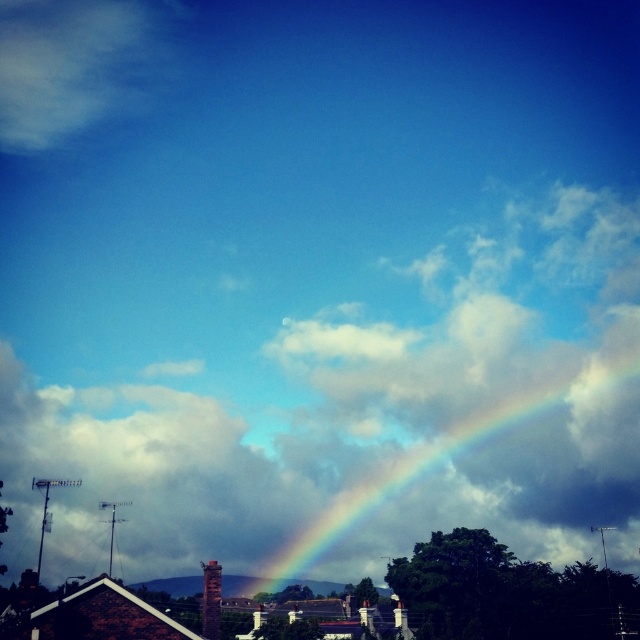
Who is lower down, white fluffy cloud at upper left or rainbow at center?

Positioned lower is rainbow at center.

From the picture: Does white fluffy cloud at upper left have a larger size compared to rainbow at center?

No, white fluffy cloud at upper left is not bigger than rainbow at center.

Which is behind, point (61, 132) or point (340, 515)?

Point (61, 132)

The height and width of the screenshot is (640, 640). What are the coordinates of `white fluffy cloud at upper left` in the screenshot? It's located at (76, 65).

Describe the element at coordinates (364, 413) in the screenshot. The width and height of the screenshot is (640, 640). I see `cloudy sky at upper center` at that location.

Which is behind, point (524, 356) or point (296, 563)?

The point (524, 356) is behind.

Locate an element on the screen. This screenshot has height=640, width=640. cloudy sky at upper center is located at coordinates (364, 413).

What do you see at coordinates (364, 413) in the screenshot?
I see `cloudy sky at upper center` at bounding box center [364, 413].

Is point (451, 241) positioned after point (45, 32)?

No, it is in front of (45, 32).

This screenshot has width=640, height=640. Identify the location of cloudy sky at upper center. (364, 413).